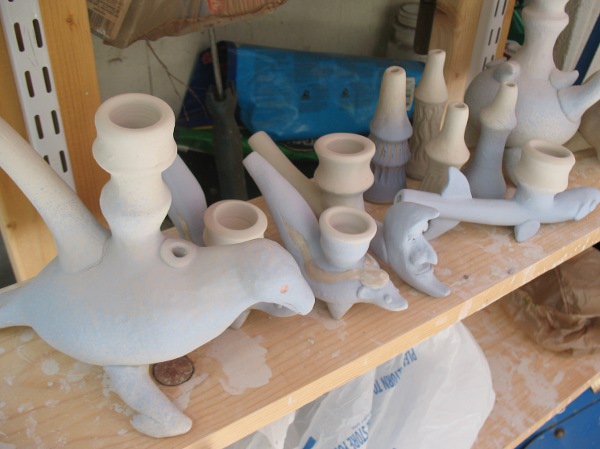
Look for how the shelf attaches to the wall in the image and show me where they are. Your answer should be formatted as a list of tuples, i.e. [(x1, y1), (x2, y2), ...], where each tuple contains the x and y coordinates of a point satisfying the conditions above.

[(43, 101), (490, 35)]